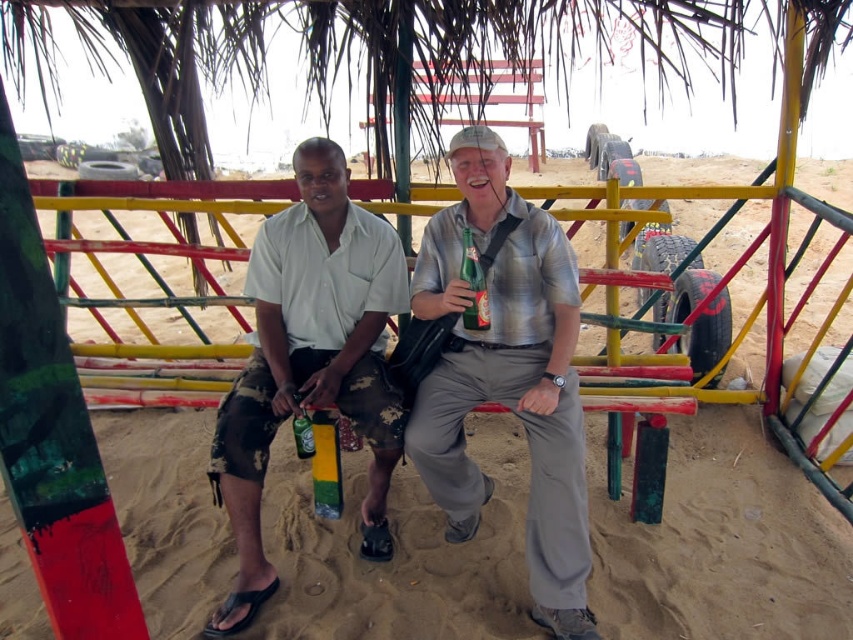
Who is positioned more to the right, matte gray shirt at center or camouflage shorts at center?

Positioned to the right is matte gray shirt at center.

Is matte gray shirt at center bigger than camouflage shorts at center?

No.

Describe the element at coordinates (506, 376) in the screenshot. I see `matte gray shirt at center` at that location.

Where is `matte gray shirt at center`? Image resolution: width=853 pixels, height=640 pixels. matte gray shirt at center is located at coordinates (506, 376).

Which is in front, point (488, 380) or point (471, 284)?

Point (471, 284) is more forward.

Does matte gray shirt at center have a greater width compared to green glass bottle at center?

Correct, the width of matte gray shirt at center exceeds that of green glass bottle at center.

Who is more forward, (500,177) or (485,273)?

Positioned in front is point (500,177).

At what (x,y) coordinates should I click in order to perform the action: click on matte gray shirt at center. Please return your answer as a coordinate pair (x, y). Looking at the image, I should click on (506, 376).

Is camouflage shorts at center shorter than green matte can at lower center?

In fact, camouflage shorts at center may be taller than green matte can at lower center.

Can you confirm if camouflage shorts at center is smaller than green matte can at lower center?

Incorrect, camouflage shorts at center is not smaller in size than green matte can at lower center.

Which is in front, point (260, 577) or point (296, 420)?

Positioned in front is point (260, 577).

Identify the location of camouflage shorts at center. (310, 358).